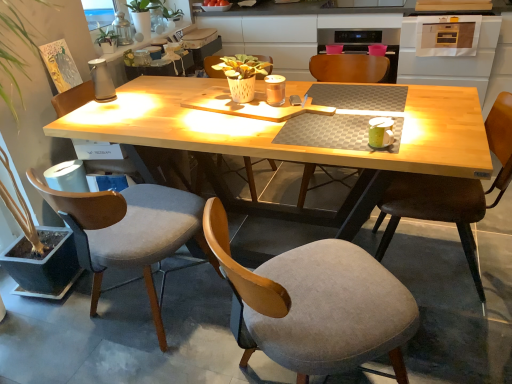
I want to click on vacant location behind green matte coffee cup at upper right, so click(x=372, y=124).